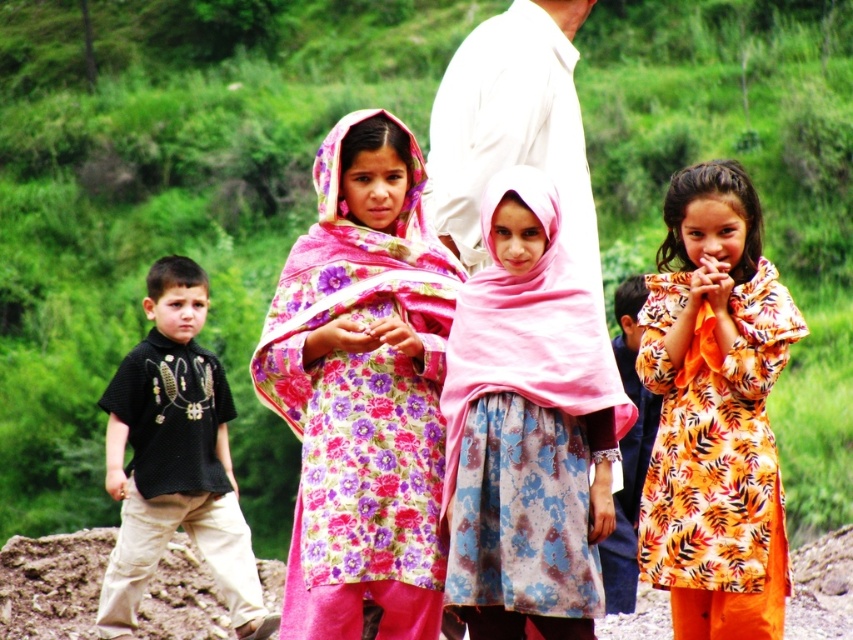
Question: Which object is the closest to the dirt field at lower center?

Choices:
 (A) floral fabric dress at center
 (B) pink fabric headscarf at center
 (C) black cotton shirt at left

Answer: (C)

Question: Does printed cotton dress at center appear under dirt field at lower center?

Choices:
 (A) yes
 (B) no

Answer: (B)

Question: Which object is the closest to the dirt field at lower center?

Choices:
 (A) printed cotton dress at center
 (B) pink fabric headscarf at center

Answer: (A)

Question: Which of the following is the closest to the observer?

Choices:
 (A) pink fabric headscarf at center
 (B) printed cotton dress at center
 (C) floral fabric dress at center
 (D) dirt field at lower center

Answer: (A)

Question: Is the position of floral fabric dress at center less distant than that of printed cotton dress at center?

Choices:
 (A) no
 (B) yes

Answer: (B)

Question: Is the position of pink fabric headscarf at center more distant than that of dirt field at lower center?

Choices:
 (A) yes
 (B) no

Answer: (B)